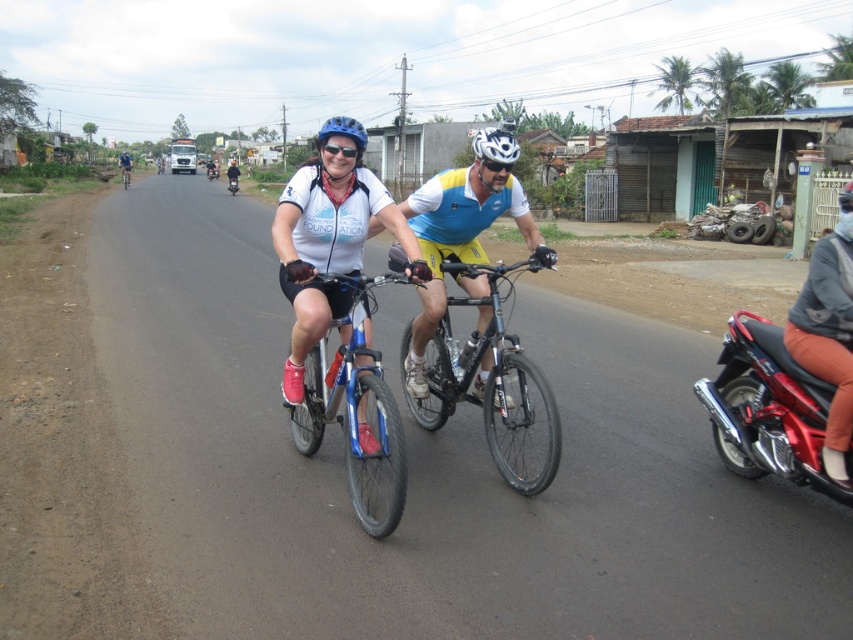
Question: Which object is positioned farthest from the blue metallic bicycle at center?

Choices:
 (A) transparent plastic goggles at center
 (B) blue/yellow cycling jersey at center

Answer: (A)

Question: Does blue matte bicycle helmet at center appear under transparent plastic goggles at center?

Choices:
 (A) no
 (B) yes

Answer: (A)

Question: Can you confirm if shiny metallic bicycle at center is smaller than black matte goggles at center?

Choices:
 (A) yes
 (B) no

Answer: (B)

Question: Which of the following is the closest to the observer?

Choices:
 (A) black matte goggles at center
 (B) blue metallic bicycle at center
 (C) blue matte bicycle helmet at center

Answer: (B)

Question: Does blue matte bicycle helmet at center have a smaller size compared to transparent plastic goggles at center?

Choices:
 (A) yes
 (B) no

Answer: (B)

Question: Which object appears closest to the camera in this image?

Choices:
 (A) transparent plastic goggles at center
 (B) blue/yellow cycling jersey at center

Answer: (B)